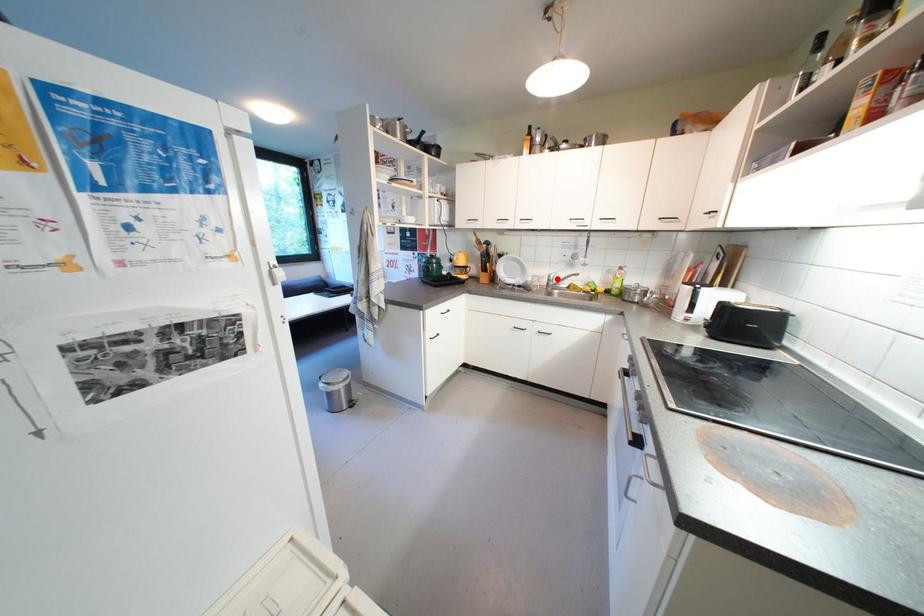
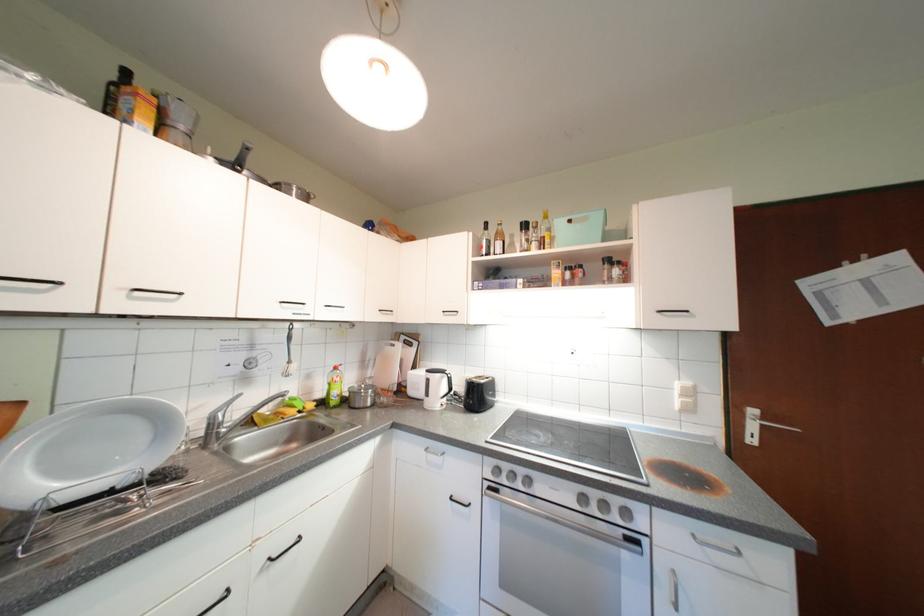
Question: I am providing you with two images of the same scene from different viewpoints. A red point is shown in image1. For the corresponding object point in image2, is it positioned nearer or farther from the camera?

Choices:
 (A) Nearer
 (B) Farther

Answer: (B)